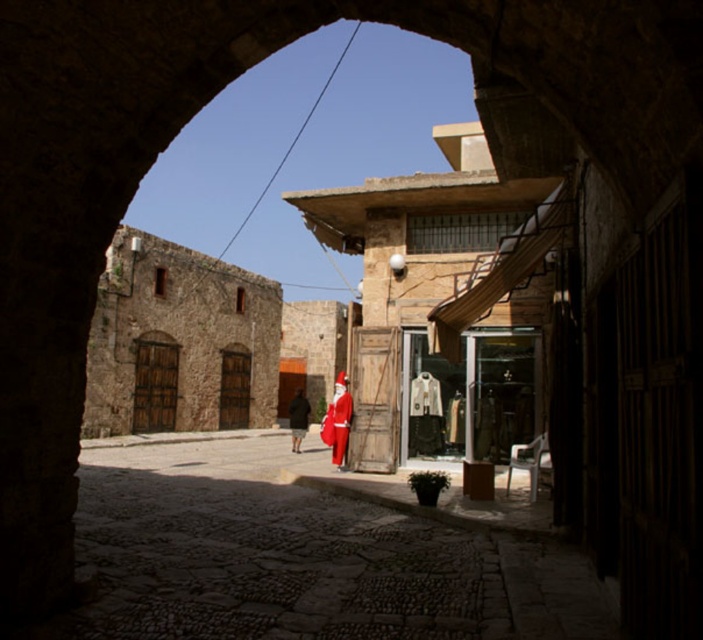
Question: Observing the image, what is the correct spatial positioning of red matte santa suit at center in reference to red velvet santa suit at center?

Choices:
 (A) above
 (B) below

Answer: (A)

Question: Which of the following is the farthest from the observer?

Choices:
 (A) red matte santa suit at center
 (B) red velvet santa suit at center

Answer: (B)

Question: Is red matte santa suit at center positioned before red velvet santa suit at center?

Choices:
 (A) yes
 (B) no

Answer: (A)

Question: Does red matte santa suit at center appear on the left side of red velvet santa suit at center?

Choices:
 (A) no
 (B) yes

Answer: (A)

Question: Which object appears closest to the camera in this image?

Choices:
 (A) red matte santa suit at center
 (B) red velvet santa suit at center

Answer: (A)